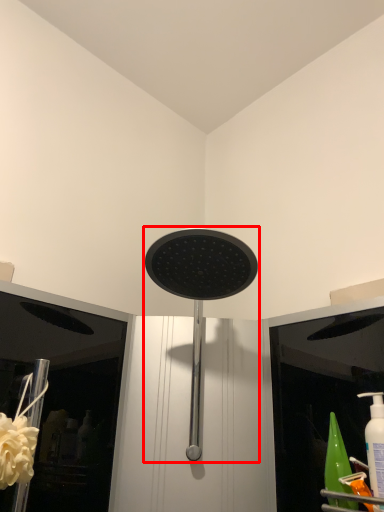
Question: From the image's perspective, what is the correct spatial positioning of shower (annotated by the red box) in reference to flower?

Choices:
 (A) above
 (B) below

Answer: (A)